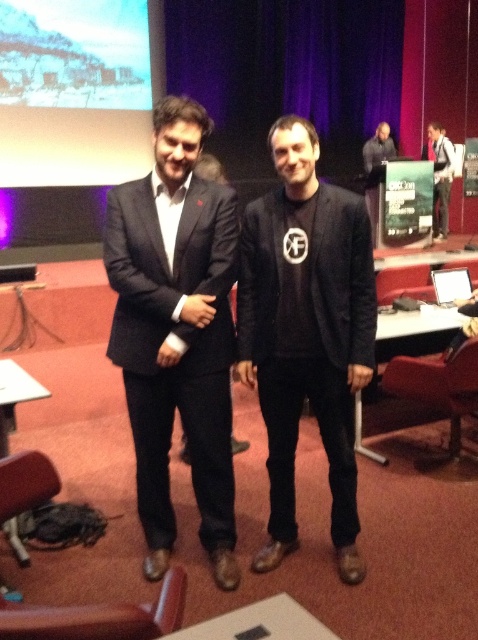
You are a photographer at the event and need to capture a photo where the matte white screen at upper left and the matte black suit at center are both visible. Given that the screen is taller than the suit, how should you adjust your camera angle to ensure both are fully in frame?

Since the matte white screen at upper left is taller than the matte black suit at center, you should angle the camera upwards slightly to capture the full height of the screen while still including the suit in the frame.

You are a photographer standing at the camera position. The matte white screen at upper left is part of the stage setup. If you want to adjust the focus to capture both the screen and the two people clearly, what should you consider about the screen?

The matte white screen at upper left is 21.09 feet away from the camera. To capture both the screen and the two people clearly, ensure the focus is set at a distance that accommodates both the screen and the subjects, considering the screen is 21.09 feet away.